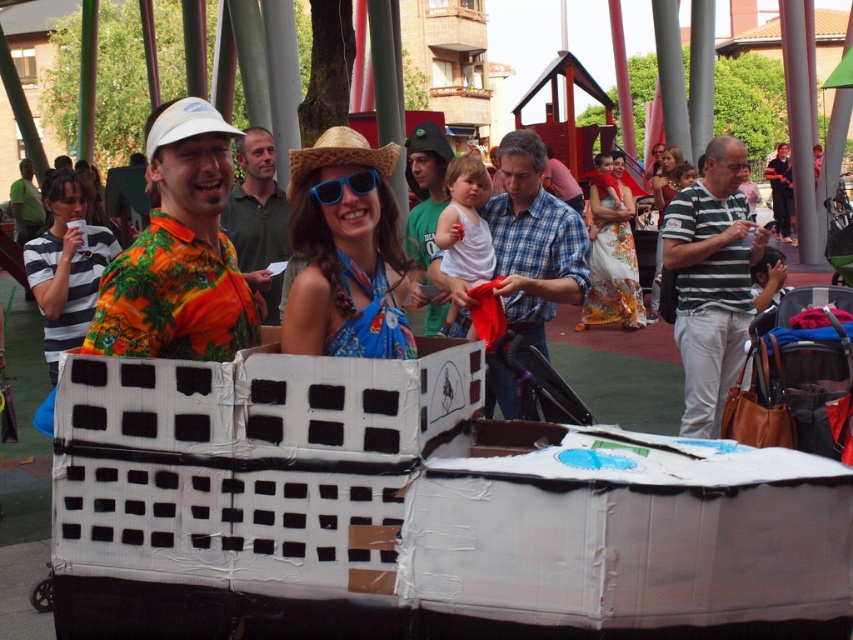
You are a photographer at the event and want to capture a closeup shot of both the blue fabric dress at center and the blue plastic goggles at center. Which object should you zoom in on first to ensure it fits in the frame without cropping?

The blue fabric dress at center is bigger than the blue plastic goggles at center, so you should zoom in on the blue fabric dress at center first to ensure it fits in the frame without cropping.

You are standing at the center of the image and want to find the blue plaid shirt at center. According to the coordinates provided, in which direction should you look to locate it?

The blue plaid shirt at center is located at coordinates point (534, 241), which means it is positioned slightly to the left and above the center of the image. So, you should look to the upper left direction from the center to find it.

You are a photographer at the event and want to capture a photo that includes both the blue fabric dress at center and the blue plastic goggles at center. Which object should you focus on first to ensure both are in the frame?

The blue fabric dress at center is below the blue plastic goggles at center, so you should focus on the blue plastic goggles at center first to ensure both are in the frame.